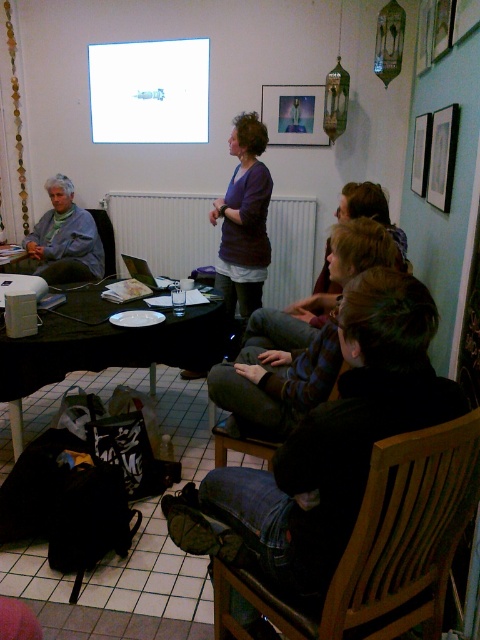
Is wooden chair at lower right above white glossy projector screen at upper center?

Actually, wooden chair at lower right is below white glossy projector screen at upper center.

Can you confirm if wooden chair at lower right is positioned to the left of white glossy projector screen at upper center?

No, wooden chair at lower right is not to the left of white glossy projector screen at upper center.

Image resolution: width=480 pixels, height=640 pixels. What do you see at coordinates (384, 544) in the screenshot?
I see `wooden chair at lower right` at bounding box center [384, 544].

The height and width of the screenshot is (640, 480). I want to click on wooden chair at lower right, so click(384, 544).

Who is positioned more to the left, white matte radiator at center or matte gray sweater at left?

Positioned to the left is matte gray sweater at left.

Does point (193, 216) come in front of point (36, 228)?

That is False.

Where is `white matte radiator at center`? white matte radiator at center is located at coordinates (163, 230).

Who is shorter, matte gray sweater at left or matte glass picture frame at upper center?

Standing shorter between the two is matte glass picture frame at upper center.

Is matte gray sweater at left further to the viewer compared to matte glass picture frame at upper center?

No, matte gray sweater at left is closer to the viewer.

The image size is (480, 640). What do you see at coordinates (63, 240) in the screenshot? I see `matte gray sweater at left` at bounding box center [63, 240].

The image size is (480, 640). Identify the location of matte gray sweater at left. (63, 240).